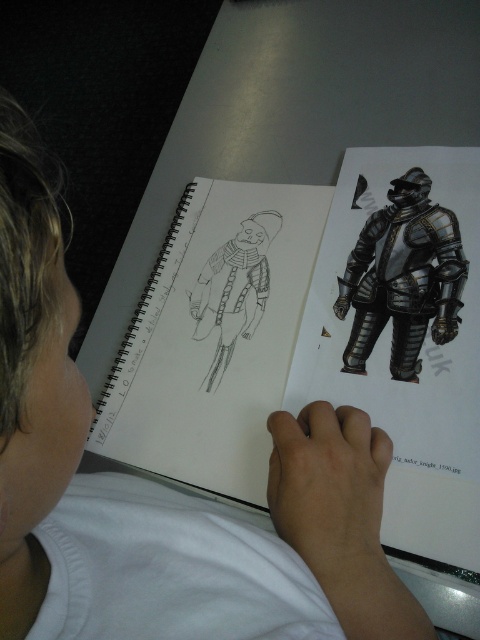
Question: Among these objects, which one is farthest from the camera?

Choices:
 (A) graphite sketch at center
 (B) black paper sketchbook at upper center
 (C) shiny metallic armor at upper right

Answer: (A)

Question: Considering the real-world distances, which object is closest to the shiny metallic armor at upper right?

Choices:
 (A) graphite sketch at center
 (B) black paper sketchbook at upper center

Answer: (A)

Question: Does shiny metallic armor at upper right appear on the left side of graphite sketch at center?

Choices:
 (A) no
 (B) yes

Answer: (A)

Question: Considering the relative positions of shiny metallic armor at upper right and graphite sketch at center in the image provided, where is shiny metallic armor at upper right located with respect to graphite sketch at center?

Choices:
 (A) right
 (B) left

Answer: (A)

Question: Is black paper sketchbook at upper center above shiny metallic armor at upper right?

Choices:
 (A) no
 (B) yes

Answer: (A)

Question: Which is farther from the shiny metallic armor at upper right?

Choices:
 (A) black paper sketchbook at upper center
 (B) graphite sketch at center

Answer: (A)